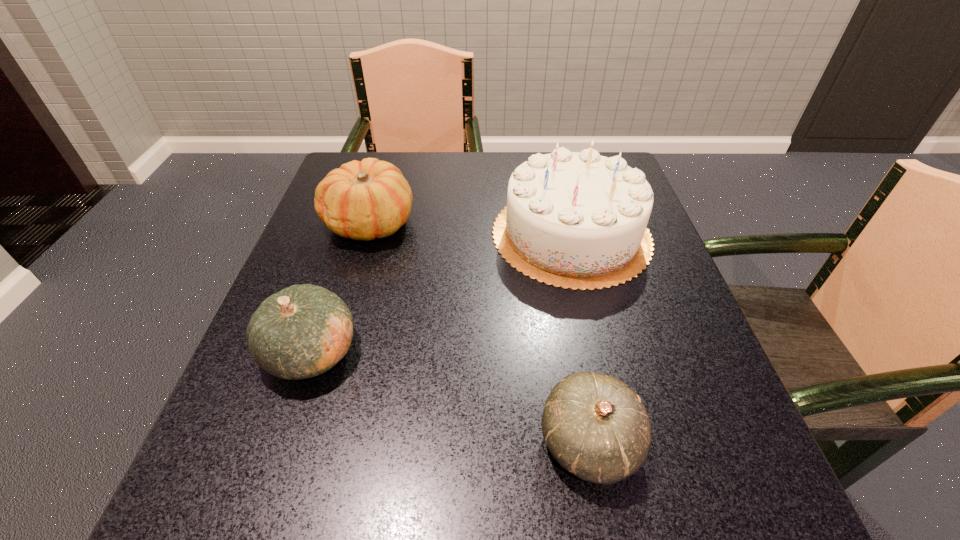
Locate an element on the screen. This screenshot has width=960, height=540. vacant space in between the farthest gourd and the tallest object is located at coordinates (470, 228).

The height and width of the screenshot is (540, 960). Find the location of `empty space between the birthday cake and the third farthest object`. empty space between the birthday cake and the third farthest object is located at coordinates (442, 293).

Find the location of `the second closest object to the shortest gourd`. the second closest object to the shortest gourd is located at coordinates (302, 331).

Where is `object that ranks as the third closest to the second farthest gourd`? object that ranks as the third closest to the second farthest gourd is located at coordinates click(597, 428).

Identify the location of gourd that is the second closest to the farthest gourd. The width and height of the screenshot is (960, 540). (597, 428).

At what (x,y) coordinates should I click in order to perform the action: click on the second closest gourd to the rightmost gourd. Please return your answer as a coordinate pair (x, y). Looking at the image, I should click on (370, 199).

The width and height of the screenshot is (960, 540). I want to click on free spot that satisfies the following two spatial constraints: 1. on the front side of the nearest object; 2. on the right side of the farthest gourd, so [305, 442].

Identify the location of vacant region that satisfies the following two spatial constraints: 1. on the back side of the farthest gourd; 2. on the right side of the second farthest gourd. (354, 222).

You are a GUI agent. You are given a task and a screenshot of the screen. Output one action in this format:
    pyautogui.click(x=<x>, y=<y>)
    Task: Click on the free space that satisfies the following two spatial constraints: 1. on the front side of the nearest object; 2. on the left side of the farthest gourd
    
    Given the screenshot: What is the action you would take?
    pyautogui.click(x=305, y=442)